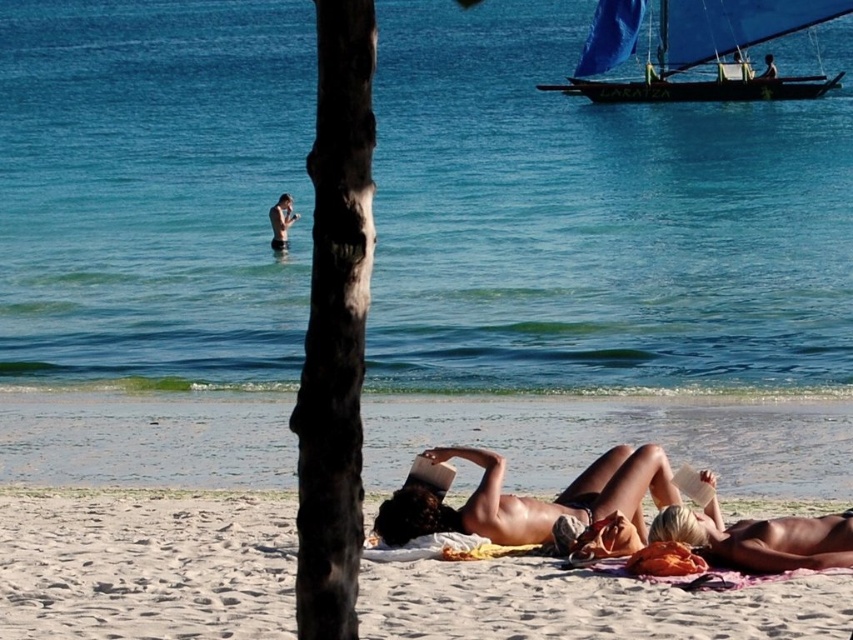
I want to click on blue sailboat at upper right, so click(715, 52).

Which is below, blue sailboat at upper right or smooth skin torso at center?

smooth skin torso at center is below.

Is point (640, 83) positioned after point (287, 227)?

Yes, point (640, 83) is farther from viewer.

The height and width of the screenshot is (640, 853). In order to click on blue sailboat at upper right in this screenshot , I will do `click(715, 52)`.

Who is lower down, white sandy beach at lower center or smooth skin torso at center?

Positioned lower is white sandy beach at lower center.

Does point (57, 572) come farther from viewer compared to point (281, 224)?

That is False.

Is point (548, 588) positioned before point (282, 216)?

Yes.

Where is `white sandy beach at lower center`? The height and width of the screenshot is (640, 853). white sandy beach at lower center is located at coordinates 144,564.

Between point (744, 10) and point (415, 534), which one is positioned behind?

Point (744, 10)

At what (x,y) coordinates should I click in order to perform the action: click on blue sailboat at upper right. Please return your answer as a coordinate pair (x, y). The height and width of the screenshot is (640, 853). Looking at the image, I should click on (715, 52).

Is point (601, 97) positioned behind point (438, 449)?

Yes, it is.

Image resolution: width=853 pixels, height=640 pixels. In order to click on blue sailboat at upper right in this screenshot , I will do `click(715, 52)`.